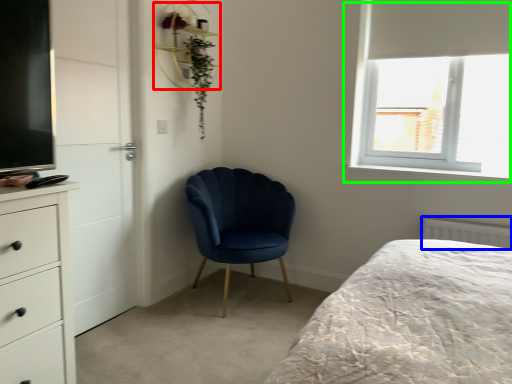
Question: Based on their relative distances, which object is nearer to shelf (highlighted by a red box)? Choose from radiator (highlighted by a blue box) and window (highlighted by a green box).

Choices:
 (A) radiator
 (B) window

Answer: (B)